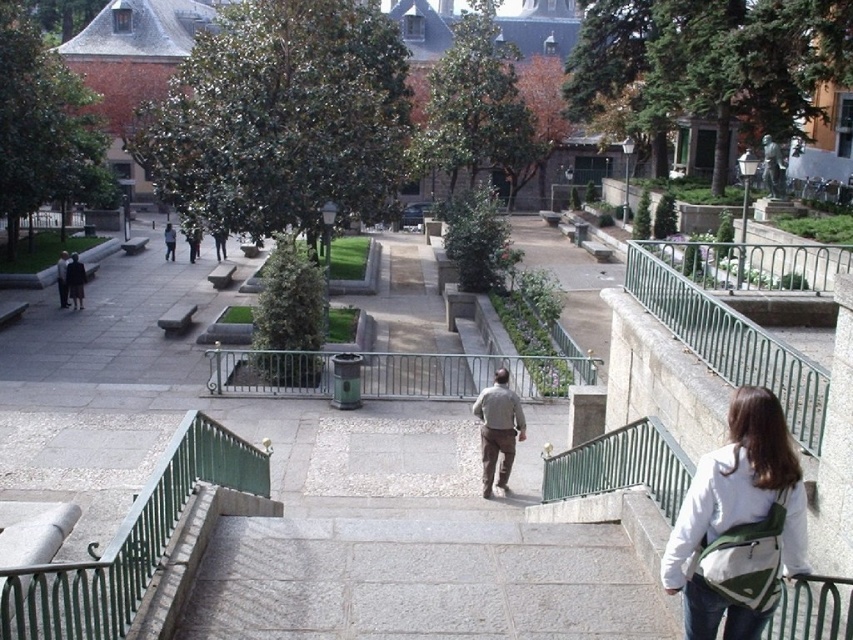
Question: Does green metal railing at upper right lie in front of dark gray wool coat at left?

Choices:
 (A) no
 (B) yes

Answer: (B)

Question: Is green metal railing at lower left to the right of green metal railing at upper right from the viewer's perspective?

Choices:
 (A) no
 (B) yes

Answer: (A)

Question: Among these objects, which one is nearest to the camera?

Choices:
 (A) green metal railing at upper right
 (B) white fabric backpack at right
 (C) light brown fabric pants at center

Answer: (B)

Question: Which point appears closest to the camera in this image?

Choices:
 (A) (709, 604)
 (B) (485, 428)
 (C) (56, 269)

Answer: (A)

Question: Which object appears closest to the camera in this image?

Choices:
 (A) light brown fabric pants at center
 (B) dark gray wool coat at left
 (C) green metal railing at lower left

Answer: (C)

Question: Can you confirm if green metal railing at upper right is positioned above dark gray wool coat at left?

Choices:
 (A) no
 (B) yes

Answer: (A)